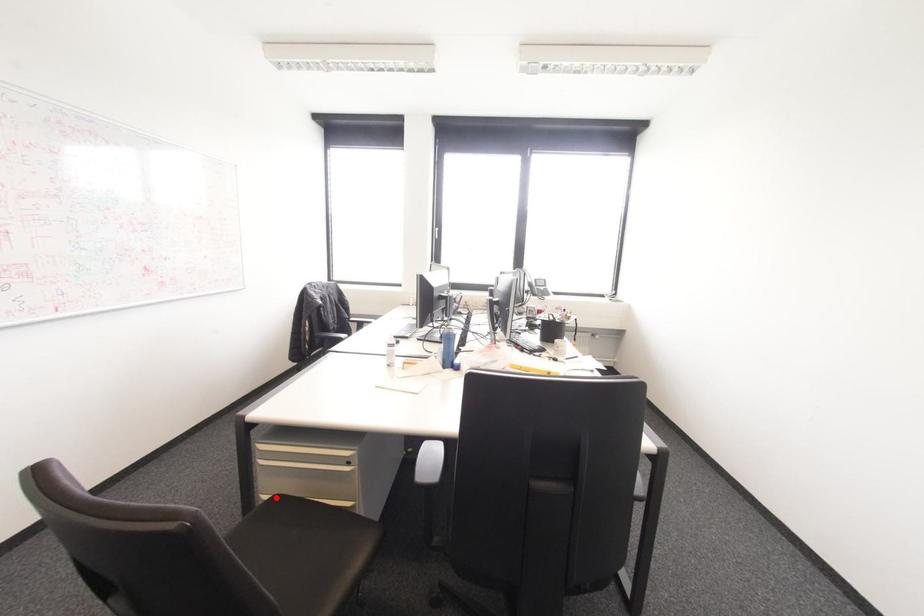
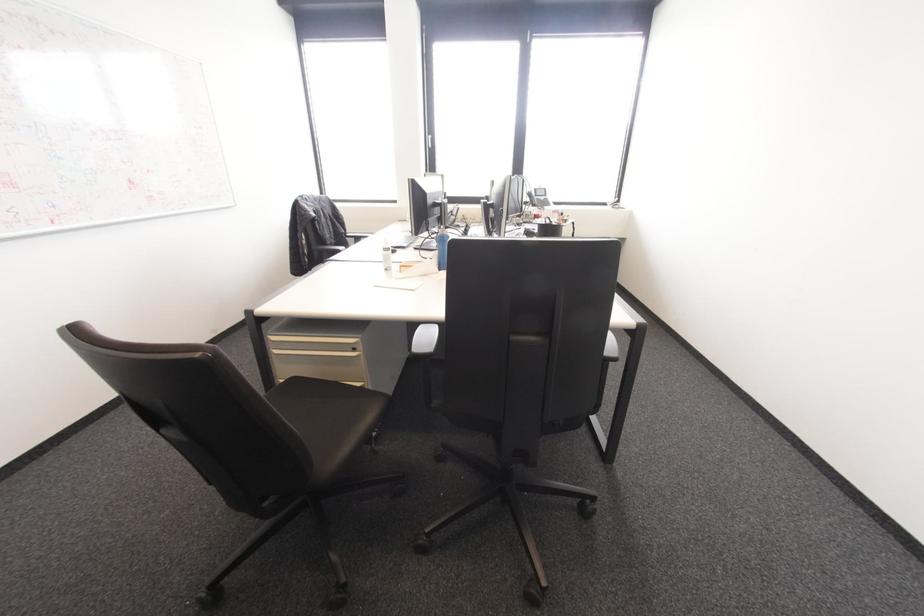
Find the pixel in the second image that matches the highlighted location in the first image.

(294, 379)